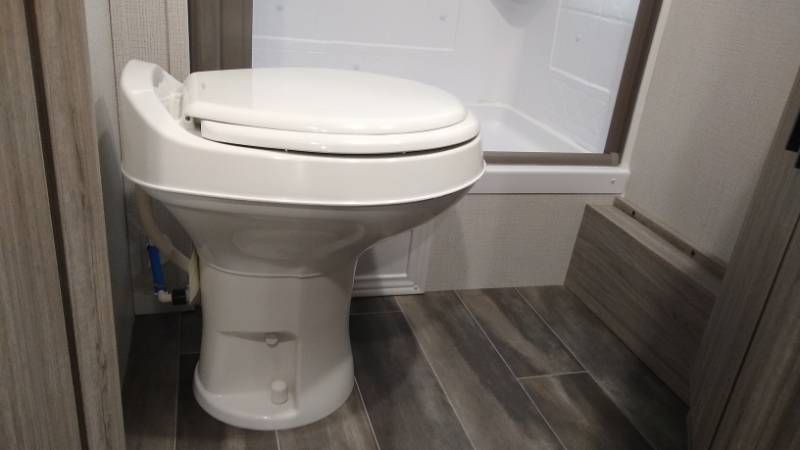
Find the location of a particular element. white wall is located at coordinates (525, 72).